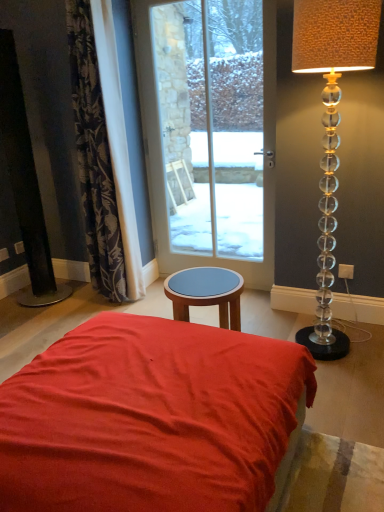
Locate an element on the screen. This screenshot has height=512, width=384. vacant space in front of translucent glass lamp at right is located at coordinates (347, 384).